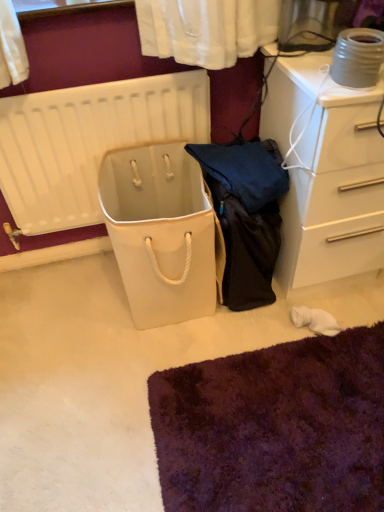
What are the coordinates of `white matte radiator at left` in the screenshot? It's located at (88, 141).

This screenshot has width=384, height=512. What do you see at coordinates (88, 141) in the screenshot?
I see `white matte radiator at left` at bounding box center [88, 141].

Describe the element at coordinates (326, 173) in the screenshot. I see `white glossy chest of drawers at upper right` at that location.

The width and height of the screenshot is (384, 512). I want to click on white glossy chest of drawers at upper right, so click(326, 173).

The image size is (384, 512). In order to click on white matte radiator at left in this screenshot , I will do `click(88, 141)`.

Looking at this image, visually, is white glossy chest of drawers at upper right positioned to the left or to the right of white matte radiator at left?

In the image, white glossy chest of drawers at upper right appears on the right side of white matte radiator at left.

Which object is closer to the camera, white glossy chest of drawers at upper right or white matte radiator at left?

white glossy chest of drawers at upper right.

Does point (280, 134) come farther from viewer compared to point (24, 229)?

No, (280, 134) is in front of (24, 229).

From the image's perspective, is white glossy chest of drawers at upper right over white matte radiator at left?

Yes, from the image's perspective, white glossy chest of drawers at upper right is on top of white matte radiator at left.

From a real-world perspective, is white glossy chest of drawers at upper right positioned above or below white matte radiator at left?

Clearly, from a real-world perspective, white glossy chest of drawers at upper right is below white matte radiator at left.

Does white glossy chest of drawers at upper right have a greater width compared to white matte radiator at left?

Yes.

Who is taller, white glossy chest of drawers at upper right or white matte radiator at left?

With more height is white glossy chest of drawers at upper right.

Considering the sizes of objects white glossy chest of drawers at upper right and white matte radiator at left in the image provided, who is smaller, white glossy chest of drawers at upper right or white matte radiator at left?

With smaller size is white matte radiator at left.

Would you say white matte radiator at left is part of white glossy chest of drawers at upper right's contents?

Actually, white matte radiator at left is outside white glossy chest of drawers at upper right.

From the picture: Are white glossy chest of drawers at upper right and white matte radiator at left beside each other?

No, white glossy chest of drawers at upper right is not next to white matte radiator at left.

In the scene shown: Is white glossy chest of drawers at upper right facing away from white matte radiator at left?

No, white matte radiator at left is not at the back of white glossy chest of drawers at upper right.

Can you tell me how much white glossy chest of drawers at upper right and white matte radiator at left differ in facing direction?

The angular difference between white glossy chest of drawers at upper right and white matte radiator at left is 0.502 degrees.

Identify the location of radiator below the white glossy chest of drawers at upper right (from the image's perspective). (88, 141).

Visually, is white matte radiator at left positioned to the left or to the right of white glossy chest of drawers at upper right?

white matte radiator at left is to the left of white glossy chest of drawers at upper right.

Is white matte radiator at left behind white glossy chest of drawers at upper right?

Yes, it is behind white glossy chest of drawers at upper right.

Which is behind, point (12, 126) or point (281, 96)?

Positioned behind is point (12, 126).

From the image's perspective, is white matte radiator at left above or below white glossy chest of drawers at upper right?

Based on their image positions, white matte radiator at left is located beneath white glossy chest of drawers at upper right.

From a real-world perspective, between white matte radiator at left and white glossy chest of drawers at upper right, who is vertically higher?

From a 3D spatial view, white matte radiator at left is above.

Consider the image. Considering the relative sizes of white matte radiator at left and white glossy chest of drawers at upper right in the image provided, is white matte radiator at left wider than white glossy chest of drawers at upper right?

Incorrect, the width of white matte radiator at left does not surpass that of white glossy chest of drawers at upper right.

From the picture: Which of these two, white matte radiator at left or white glossy chest of drawers at upper right, stands shorter?

white matte radiator at left.

Does white matte radiator at left have a larger size compared to white glossy chest of drawers at upper right?

No.

Can we say white matte radiator at left lies outside white glossy chest of drawers at upper right?

Yes, white matte radiator at left is located beyond the bounds of white glossy chest of drawers at upper right.

Consider the image. Is white matte radiator at left placed right next to white glossy chest of drawers at upper right?

No, white matte radiator at left is not touching white glossy chest of drawers at upper right.

Is white matte radiator at left oriented away from white glossy chest of drawers at upper right?

No, white matte radiator at left is not facing the opposite direction of white glossy chest of drawers at upper right.

What's the angular difference between white matte radiator at left and white glossy chest of drawers at upper right's facing directions?

0.502 degrees.

Find the location of a particular element. This screenshot has width=384, height=512. radiator located on the left of white glossy chest of drawers at upper right is located at coordinates (88, 141).

Where is `the chest of drawers lying in front of the white matte radiator at left`? The width and height of the screenshot is (384, 512). the chest of drawers lying in front of the white matte radiator at left is located at coordinates [326, 173].

Where is `chest of drawers located on the right of white matte radiator at left`? This screenshot has height=512, width=384. chest of drawers located on the right of white matte radiator at left is located at coordinates (326, 173).